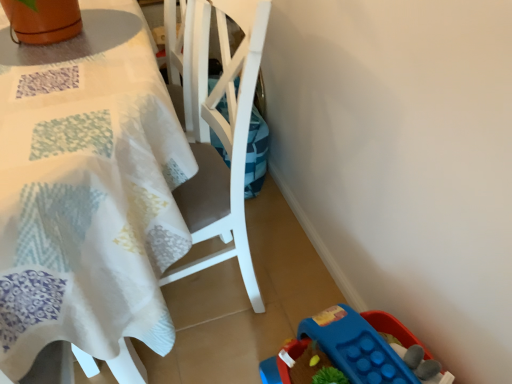
Question: Is white fabric table at upper left further to camera compared to blue plastic toy at lower right?

Choices:
 (A) yes
 (B) no

Answer: (B)

Question: Would you say blue plastic toy at lower right is part of white fabric table at upper left's contents?

Choices:
 (A) yes
 (B) no

Answer: (B)

Question: From a real-world perspective, is white fabric table at upper left physically below blue plastic toy at lower right?

Choices:
 (A) no
 (B) yes

Answer: (A)

Question: Can you confirm if white fabric table at upper left is positioned to the left of blue plastic toy at lower right?

Choices:
 (A) no
 (B) yes

Answer: (B)

Question: From the image's perspective, is white fabric table at upper left beneath blue plastic toy at lower right?

Choices:
 (A) yes
 (B) no

Answer: (B)

Question: Which is correct: white fabric table at upper left is inside blue plastic toy at lower right, or outside of it?

Choices:
 (A) outside
 (B) inside

Answer: (A)

Question: From their relative heights in the image, would you say white fabric table at upper left is taller or shorter than blue plastic toy at lower right?

Choices:
 (A) tall
 (B) short

Answer: (A)

Question: Is white fabric table at upper left in front of or behind blue plastic toy at lower right in the image?

Choices:
 (A) behind
 (B) front

Answer: (B)

Question: Does point (53, 231) appear closer or farther from the camera than point (292, 370)?

Choices:
 (A) closer
 (B) farther

Answer: (A)

Question: Looking at their shapes, would you say blue plastic toy at lower right is wider or thinner than white fabric table at upper left?

Choices:
 (A) thin
 (B) wide

Answer: (A)

Question: Is blue plastic toy at lower right spatially inside white fabric table at upper left, or outside of it?

Choices:
 (A) inside
 (B) outside

Answer: (B)

Question: In the image, is blue plastic toy at lower right positioned in front of or behind white fabric table at upper left?

Choices:
 (A) behind
 (B) front

Answer: (A)

Question: From the image's perspective, is blue plastic toy at lower right above or below white fabric table at upper left?

Choices:
 (A) below
 (B) above

Answer: (A)

Question: Is blue plastic toy at lower right taller or shorter than white plastic chair at center?

Choices:
 (A) tall
 (B) short

Answer: (B)

Question: From the image's perspective, is blue plastic toy at lower right positioned above or below white plastic chair at center?

Choices:
 (A) below
 (B) above

Answer: (A)